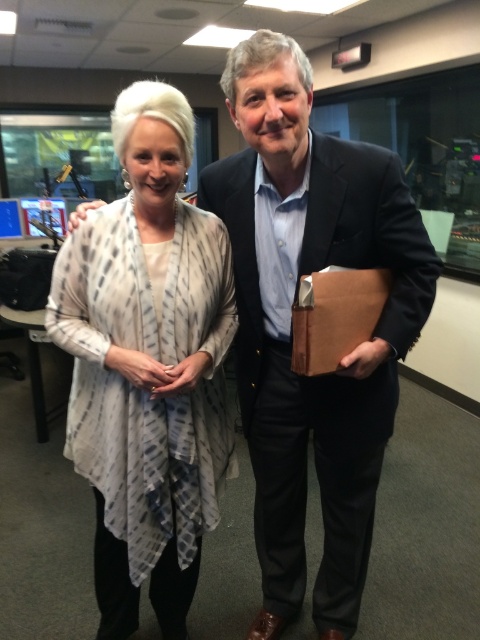
Question: Where is matte black suit at center located in relation to printed silk blouse at center in the image?

Choices:
 (A) right
 (B) left

Answer: (A)

Question: Which object is closer to the camera taking this photo?

Choices:
 (A) printed silk blouse at center
 (B) matte black suit at center

Answer: (B)

Question: Is matte black suit at center thinner than printed silk blouse at center?

Choices:
 (A) yes
 (B) no

Answer: (B)

Question: Which point is closer to the camera?

Choices:
 (A) (360, 262)
 (B) (145, 563)

Answer: (A)

Question: Considering the relative positions of matte black suit at center and printed silk blouse at center in the image provided, where is matte black suit at center located with respect to printed silk blouse at center?

Choices:
 (A) left
 (B) right

Answer: (B)